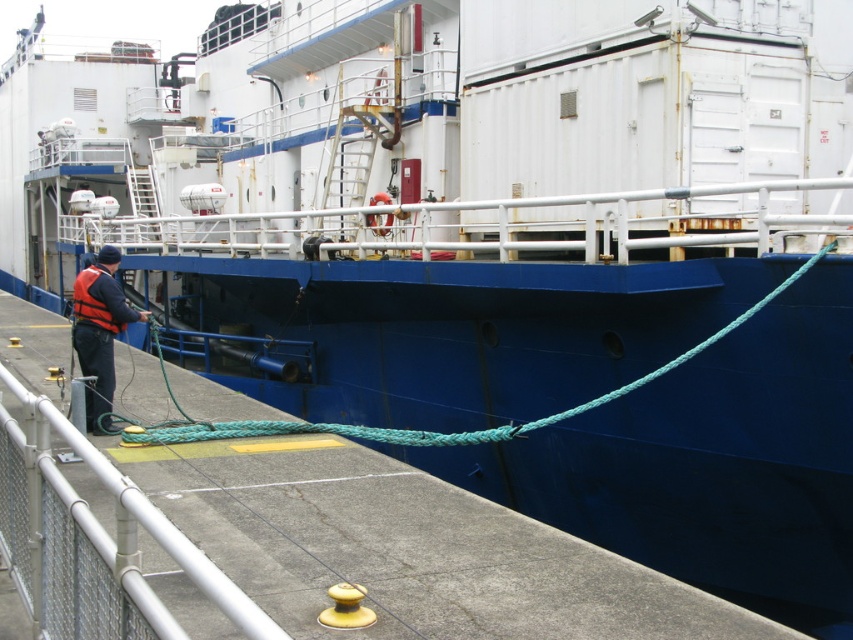
You are a dock worker standing on the dock. You need to secure the green rope at lower left to the ship. However, the matte orange life vest at left is in the way. Can you move the life vest to access the rope?

The green rope at lower left is positioned under the matte orange life vest at left, so you need to move the matte orange life vest at left to access the green rope at lower left.